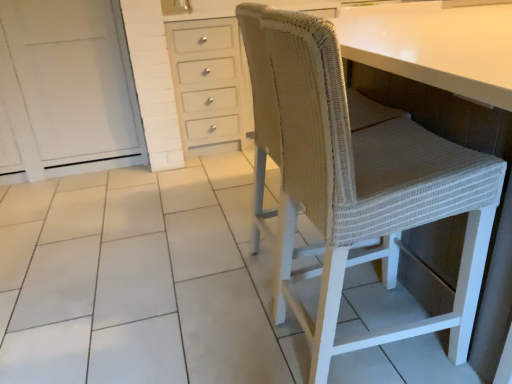
Identify the location of woven beige chair at right. The width and height of the screenshot is (512, 384). (355, 180).

Describe the element at coordinates (355, 180) in the screenshot. The height and width of the screenshot is (384, 512). I see `woven beige chair at right` at that location.

The width and height of the screenshot is (512, 384). Describe the element at coordinates (66, 90) in the screenshot. I see `white painted wood cabinet at left` at that location.

Locate an element on the screen. The image size is (512, 384). white painted wood cabinet at left is located at coordinates (66, 90).

The height and width of the screenshot is (384, 512). I want to click on woven beige chair at right, so click(355, 180).

Considering the relative positions of woven beige chair at right and white painted wood cabinet at left in the image provided, is woven beige chair at right to the right of white painted wood cabinet at left from the viewer's perspective?

Yes, woven beige chair at right is to the right of white painted wood cabinet at left.

Between woven beige chair at right and white painted wood cabinet at left, which one is positioned in front?

Positioned in front is woven beige chair at right.

Which is more distant, (475, 255) or (42, 13)?

The point (42, 13) is farther from the camera.

From the image's perspective, between woven beige chair at right and white painted wood cabinet at left, which one is located above?

white painted wood cabinet at left, from the image's perspective.

From a real-world perspective, who is located lower, woven beige chair at right or white painted wood cabinet at left?

woven beige chair at right, from a real-world perspective.

Is woven beige chair at right thinner than white painted wood cabinet at left?

Correct, the width of woven beige chair at right is less than that of white painted wood cabinet at left.

Considering the relative sizes of woven beige chair at right and white painted wood cabinet at left in the image provided, is woven beige chair at right taller than white painted wood cabinet at left?

No, woven beige chair at right is not taller than white painted wood cabinet at left.

Looking at the image, does woven beige chair at right seem bigger or smaller compared to white painted wood cabinet at left?

woven beige chair at right is smaller than white painted wood cabinet at left.

Does woven beige chair at right contain white painted wood cabinet at left?

No, woven beige chair at right does not contain white painted wood cabinet at left.

Is woven beige chair at right touching white painted wood cabinet at left?

No, woven beige chair at right is not touching white painted wood cabinet at left.

Based on the photo, is woven beige chair at right aimed at white painted wood cabinet at left?

No, woven beige chair at right is not turned towards white painted wood cabinet at left.

What's the angular difference between woven beige chair at right and white painted wood cabinet at left's facing directions?

90.4 degrees separate the facing orientations of woven beige chair at right and white painted wood cabinet at left.

Based on the photo, how much distance is there between woven beige chair at right and white painted wood cabinet at left?

They are 1.72 meters apart.

Find the location of a particular element. cabinetry behind the woven beige chair at right is located at coordinates (66, 90).

Considering the relative positions of white painted wood cabinet at left and woven beige chair at right in the image provided, is white painted wood cabinet at left to the left or to the right of woven beige chair at right?

white painted wood cabinet at left is to the left of woven beige chair at right.

Based on the photo, which object is further away from the camera, white painted wood cabinet at left or woven beige chair at right?

white painted wood cabinet at left is further from the camera.

Is point (12, 56) closer to camera compared to point (405, 142)?

No, it is not.

From the image's perspective, would you say white painted wood cabinet at left is positioned over woven beige chair at right?

Yes, from the image's perspective, white painted wood cabinet at left is above woven beige chair at right.

From a real-world perspective, which is physically above, white painted wood cabinet at left or woven beige chair at right?

white painted wood cabinet at left.

From the picture: Does white painted wood cabinet at left have a lesser width compared to woven beige chair at right?

Incorrect, the width of white painted wood cabinet at left is not less than that of woven beige chair at right.

Between white painted wood cabinet at left and woven beige chair at right, which one has less height?

With less height is woven beige chair at right.

Is white painted wood cabinet at left smaller than woven beige chair at right?

No, white painted wood cabinet at left is not smaller than woven beige chair at right.

Is white painted wood cabinet at left not within woven beige chair at right?

white painted wood cabinet at left lies outside woven beige chair at right's area.

Is white painted wood cabinet at left far away from woven beige chair at right?

white painted wood cabinet at left is positioned a significant distance from woven beige chair at right.

Looking at this image, is white painted wood cabinet at left facing towards woven beige chair at right?

Yes, white painted wood cabinet at left is oriented towards woven beige chair at right.

How many degrees apart are the facing directions of white painted wood cabinet at left and woven beige chair at right?

90.4 degrees separate the facing orientations of white painted wood cabinet at left and woven beige chair at right.

In the image, there is a woven beige chair at right. Identify the location of cabinetry above it (from the image's perspective). (66, 90).

The width and height of the screenshot is (512, 384). I want to click on cabinetry above the woven beige chair at right (from a real-world perspective), so (x=66, y=90).

Locate an element on the screen. The height and width of the screenshot is (384, 512). cabinetry on the left of woven beige chair at right is located at coordinates (66, 90).